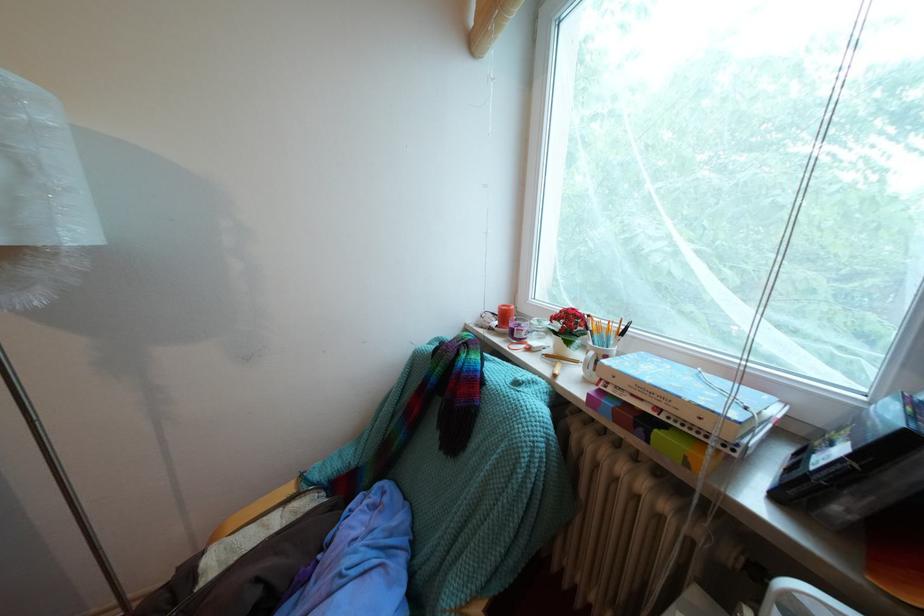
This screenshot has width=924, height=616. Describe the element at coordinates (651, 416) in the screenshot. I see `the colorful art box` at that location.